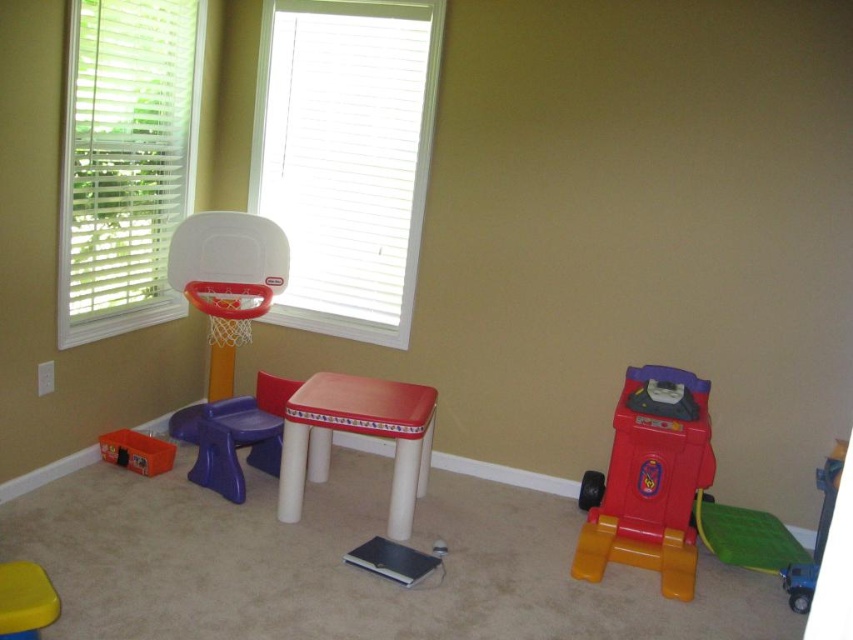
Question: Is the position of purple plastic chair at center less distant than that of yellow plastic stool at lower left?

Choices:
 (A) no
 (B) yes

Answer: (A)

Question: Observing the image, what is the correct spatial positioning of matte plastic stool at center in reference to purple plastic chair at center?

Choices:
 (A) above
 (B) below

Answer: (B)

Question: In this image, where is purple plastic chair at center located relative to orange plastic toy at lower left?

Choices:
 (A) right
 (B) left

Answer: (A)

Question: Which is farther from the matte plastic stool at center?

Choices:
 (A) purple plastic chair at center
 (B) orange plastic toy at lower left
 (C) rubberized plastic toy car at right
 (D) blue plastic toy car at lower right

Answer: (D)

Question: Which is farther from the blue plastic toy car at lower right?

Choices:
 (A) orange plastic toy at lower left
 (B) matte plastic stool at center

Answer: (A)

Question: Which point appears closest to the camera in this image?

Choices:
 (A) (799, 596)
 (B) (193, 470)
 (C) (155, 461)
 (D) (680, 524)

Answer: (A)